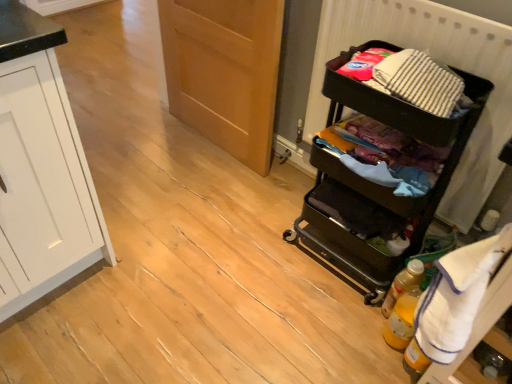
What are the coordinates of `vacant space behind translucent yellow bottle at lower right, marked as the second bottle in a front-to-back arrangement` in the screenshot? It's located at (366, 273).